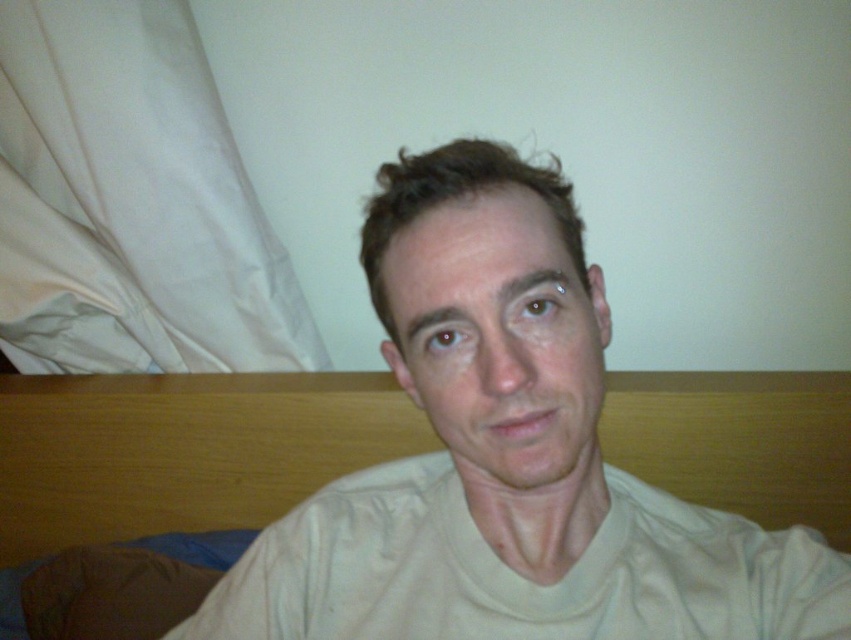
Which is above, light beige cotton shirt at center or wooden bed at center?

light beige cotton shirt at center is above.

Is point (449, 460) farther from camera compared to point (806, 481)?

That is False.

Who is more forward, (632, 534) or (730, 445)?

Point (632, 534)

What are the coordinates of `light beige cotton shirt at center` in the screenshot? It's located at (507, 458).